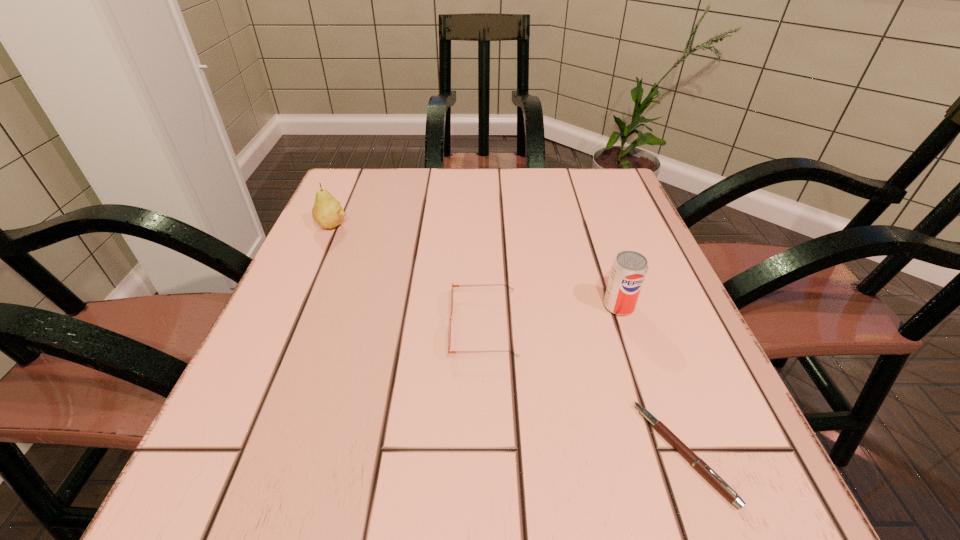
Where is `vacant space located on the face of the third object from right to left`? vacant space located on the face of the third object from right to left is located at coordinates (375, 326).

Identify the location of blank area located 0.160m on the face of the third object from right to left. This screenshot has width=960, height=540. (358, 326).

Locate an element on the screen. This screenshot has height=540, width=960. free space located at the nib of the shortest object is located at coordinates (397, 453).

You are a GUI agent. You are given a task and a screenshot of the screen. Output one action in this format:
    pyautogui.click(x=<x>, y=<y>)
    Task: Click on the free space located at the nib of the shortest object
    
    Given the screenshot: What is the action you would take?
    pyautogui.click(x=466, y=453)

Locate an element on the screen. free space located at the nib of the shortest object is located at coordinates point(420,453).

Find the location of a particular element. object that is positioned at the far edge is located at coordinates pyautogui.click(x=327, y=211).

Identify the location of object that is at the near edge. The height and width of the screenshot is (540, 960). (705, 470).

You are a GUI agent. You are given a task and a screenshot of the screen. Output one action in this format:
    pyautogui.click(x=<x>, y=<y>)
    Task: Click on the object that is at the left edge
    This screenshot has height=540, width=960.
    Given the screenshot: What is the action you would take?
    pyautogui.click(x=327, y=211)

Locate an element on the screen. This screenshot has width=960, height=540. soda that is at the right edge is located at coordinates (629, 269).

Find the location of a particular element. pen situated at the right edge is located at coordinates (705, 470).